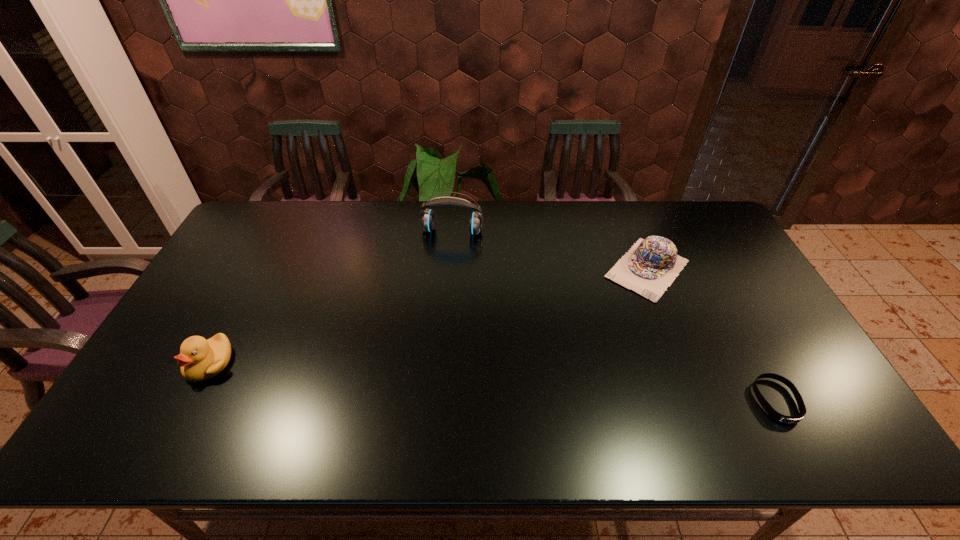
The height and width of the screenshot is (540, 960). I want to click on object that is at the near right corner, so click(775, 415).

Where is `free space at the far edge of the desktop`? free space at the far edge of the desktop is located at coordinates pos(364,211).

What are the coordinates of `vacant space at the near edge of the desktop` in the screenshot? It's located at (450, 392).

At what (x,y) coordinates should I click in order to perform the action: click on free space at the right edge of the desktop. Please return your answer as a coordinate pair (x, y). The image size is (960, 540). Looking at the image, I should click on [729, 300].

Locate an element on the screen. vacant space at the far left corner is located at coordinates (269, 234).

Find the location of a particular element. The image size is (960, 540). free region at the near left corner of the desktop is located at coordinates (174, 384).

In the image, there is a desktop. Where is `vacant space at the far right corner`? The height and width of the screenshot is (540, 960). vacant space at the far right corner is located at coordinates (665, 206).

Locate an element on the screen. free space at the near right corner is located at coordinates (787, 390).

What are the coordinates of `blank region between the third tallest object and the duckling` in the screenshot? It's located at pos(428,316).

At what (x,y) coordinates should I click in order to perform the action: click on empty space that is in between the leftmost object and the third tallest object. Please return your answer as a coordinate pair (x, y). Looking at the image, I should click on (428, 316).